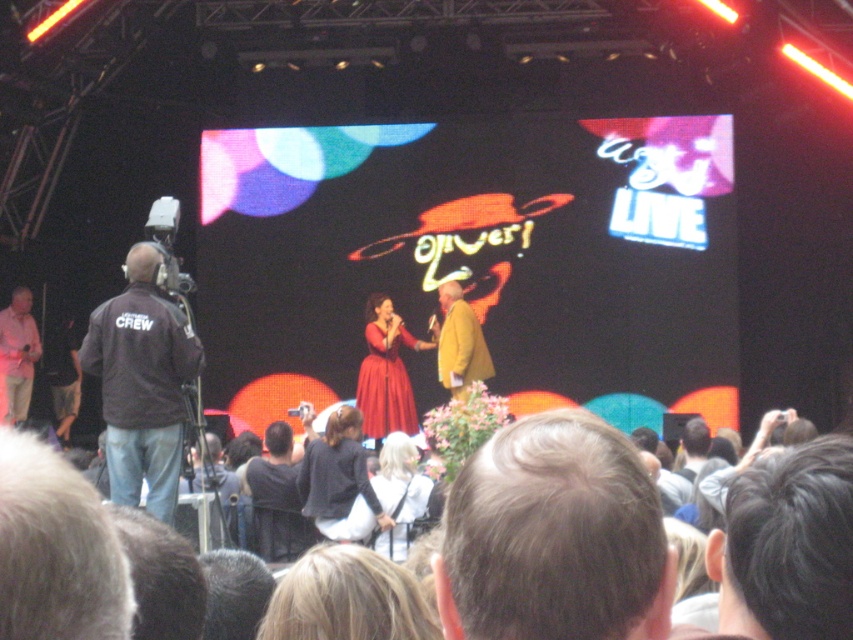
Question: In this image, where is matte red dress at center located relative to light pink shirt at left?

Choices:
 (A) right
 (B) left

Answer: (A)

Question: Which object is farther from the camera taking this photo?

Choices:
 (A) yellow textured coat at center
 (B) black fabric camera at left
 (C) matte red dress at center
 (D) dark brown hair at center

Answer: (A)

Question: Can you confirm if dark brown hair at center is positioned to the left of black fabric camera at left?

Choices:
 (A) yes
 (B) no

Answer: (B)

Question: Does dark brown hair at center appear under yellow textured coat at center?

Choices:
 (A) yes
 (B) no

Answer: (A)

Question: Which point is closer to the camera?

Choices:
 (A) (303, 515)
 (B) (407, 536)
 (C) (380, 364)

Answer: (B)

Question: Estimate the real-world distances between objects in this image. Which object is farther from the yellow textured coat at center?

Choices:
 (A) dark brown hair at center
 (B) matte red dress at center
 (C) matte black dress at center
 (D) black fabric camera at left

Answer: (A)